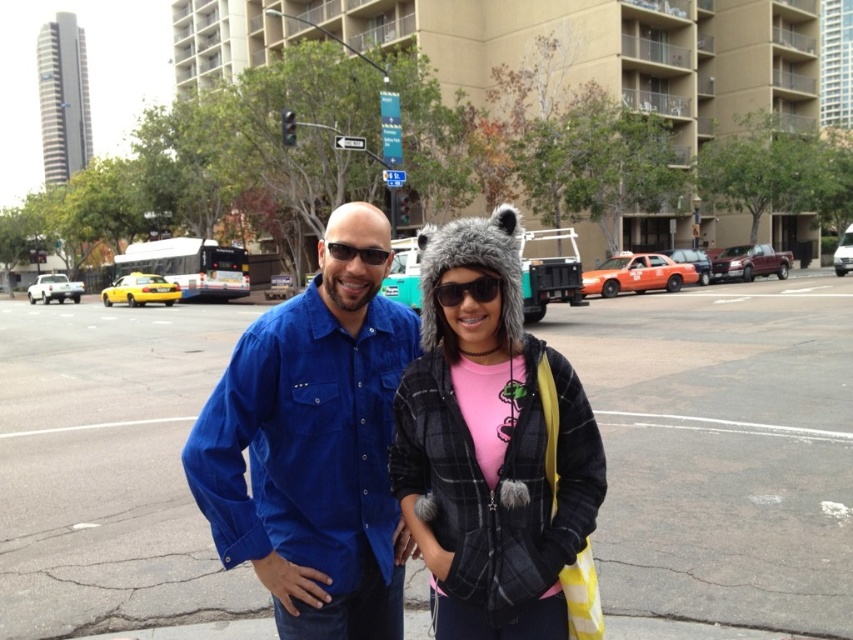
Question: Is blue corduroy shirt at center closer to the viewer compared to matte black sunglasses at center?

Choices:
 (A) no
 (B) yes

Answer: (B)

Question: Which of the following is the farthest from the observer?

Choices:
 (A) sunglasses at center
 (B) blue corduroy shirt at center
 (C) matte black sunglasses at center

Answer: (C)

Question: Which object is the closest to the sunglasses at center?

Choices:
 (A) blue corduroy shirt at center
 (B) matte black sunglasses at center
 (C) plaid fleece jacket at center

Answer: (C)

Question: Estimate the real-world distances between objects in this image. Which object is closer to the plaid fleece jacket at center?

Choices:
 (A) blue corduroy shirt at center
 (B) matte black sunglasses at center
 (C) sunglasses at center

Answer: (C)

Question: Is blue corduroy shirt at center behind plaid fleece jacket at center?

Choices:
 (A) yes
 (B) no

Answer: (A)

Question: Observing the image, what is the correct spatial positioning of plaid fleece jacket at center in reference to sunglasses at center?

Choices:
 (A) below
 (B) above

Answer: (A)